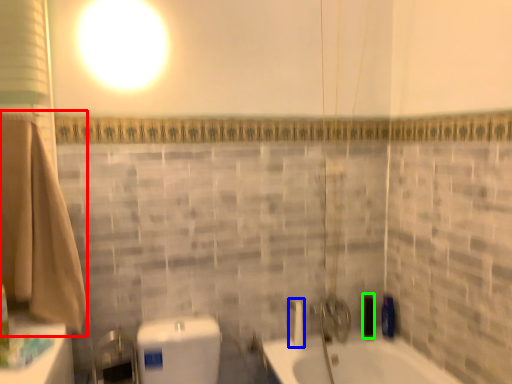
Question: Which is farther away from bath towel (highlighted by a red box)? shower (highlighted by a blue box) or toiletry (highlighted by a green box)?

Choices:
 (A) shower
 (B) toiletry

Answer: (B)